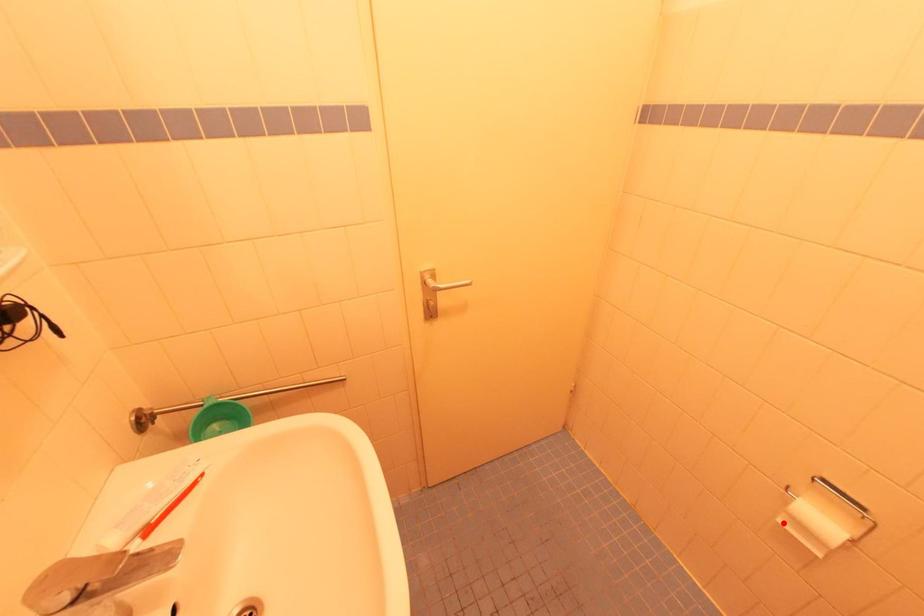
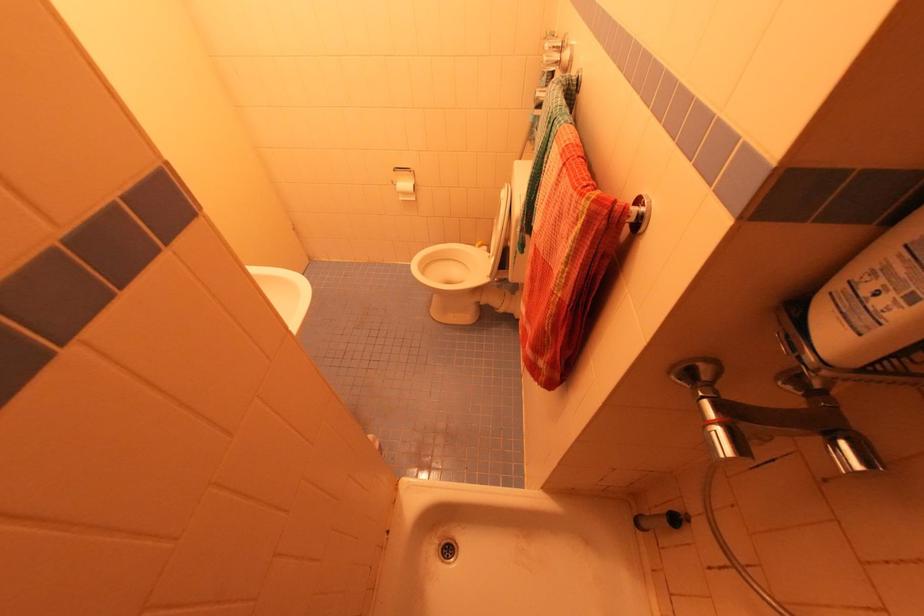
Question: I am providing you with two images of the same scene from different viewpoints. A red point is shown in image1. For the corresponding object point in image2, is it positioned nearer or farther from the camera?

Choices:
 (A) Nearer
 (B) Farther

Answer: (A)